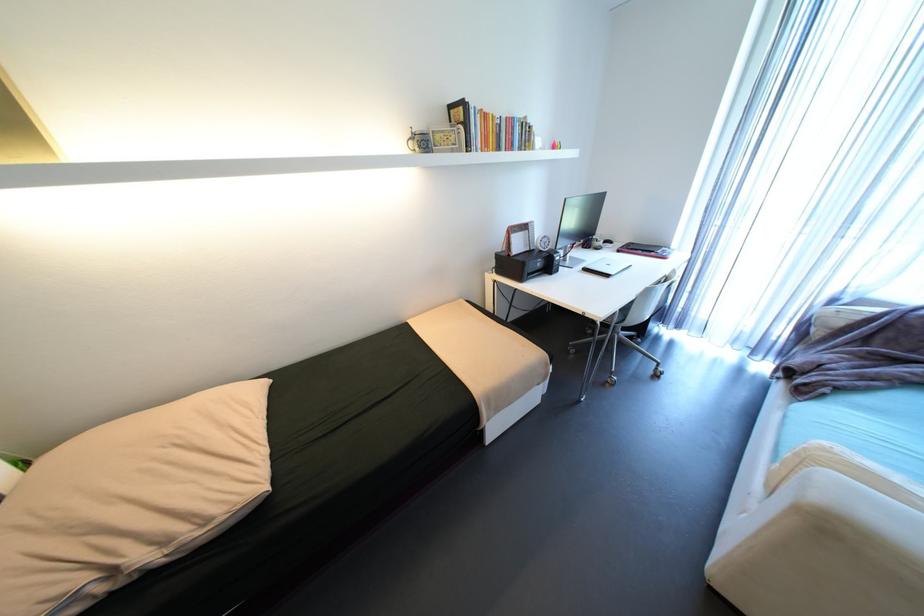
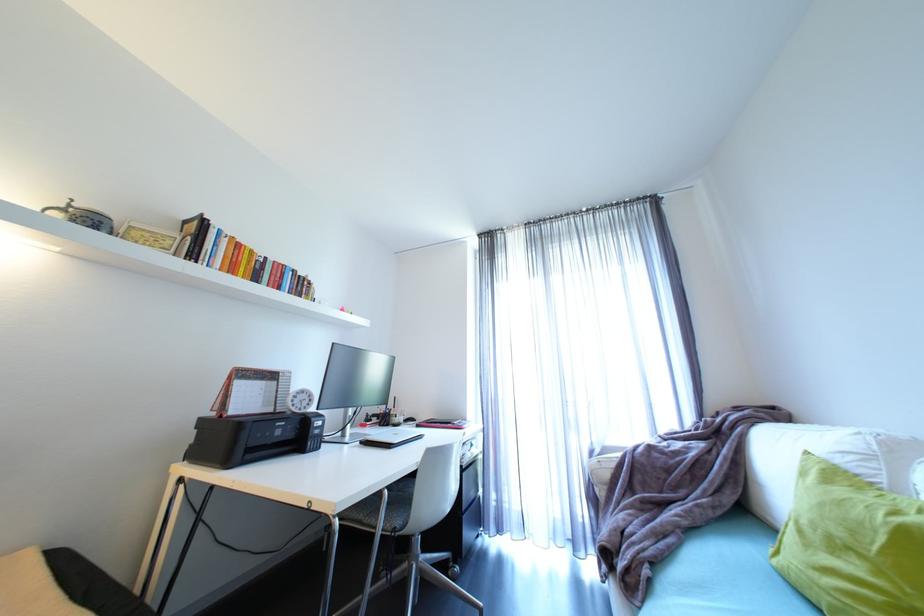
Find the pixel in the second image that matches point 417,136 in the first image.

(69, 206)